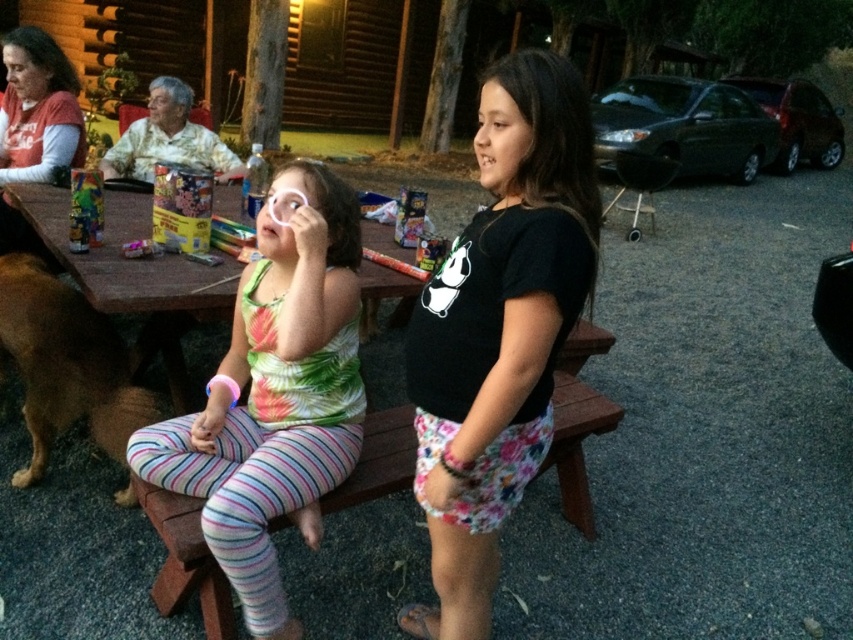
Which of these two, brown fur dog at lower left or hawaiian print shirt at upper left, stands shorter?

hawaiian print shirt at upper left is shorter.

Between brown fur dog at lower left and hawaiian print shirt at upper left, which one appears on the right side from the viewer's perspective?

From the viewer's perspective, brown fur dog at lower left appears more on the right side.

Image resolution: width=853 pixels, height=640 pixels. Describe the element at coordinates (65, 364) in the screenshot. I see `brown fur dog at lower left` at that location.

Find the location of a particular element. brown fur dog at lower left is located at coordinates (65, 364).

Who is higher up, brown wooden picnic table at center or brown fur dog at lower left?

brown wooden picnic table at center is higher up.

Which is behind, point (107, 198) or point (73, 380)?

Point (107, 198)

I want to click on brown wooden picnic table at center, so click(135, 276).

Is brown wooden picnic table at center smaller than hawaiian print shirt at upper left?

No, brown wooden picnic table at center is not smaller than hawaiian print shirt at upper left.

Can you confirm if brown wooden picnic table at center is positioned below hawaiian print shirt at upper left?

Correct, brown wooden picnic table at center is located below hawaiian print shirt at upper left.

What do you see at coordinates (135, 276) in the screenshot? This screenshot has height=640, width=853. I see `brown wooden picnic table at center` at bounding box center [135, 276].

Find the location of a particular element. This screenshot has height=640, width=853. brown wooden picnic table at center is located at coordinates (135, 276).